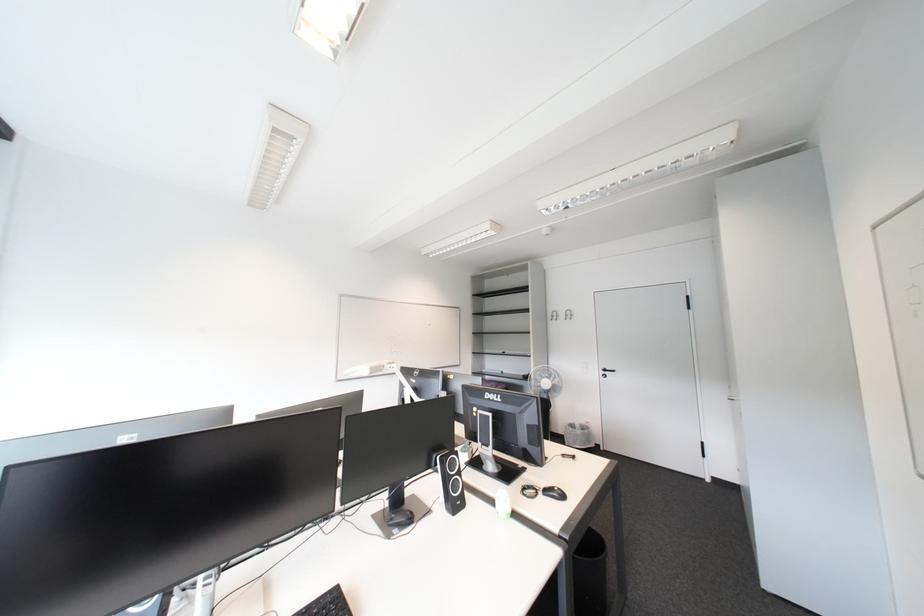
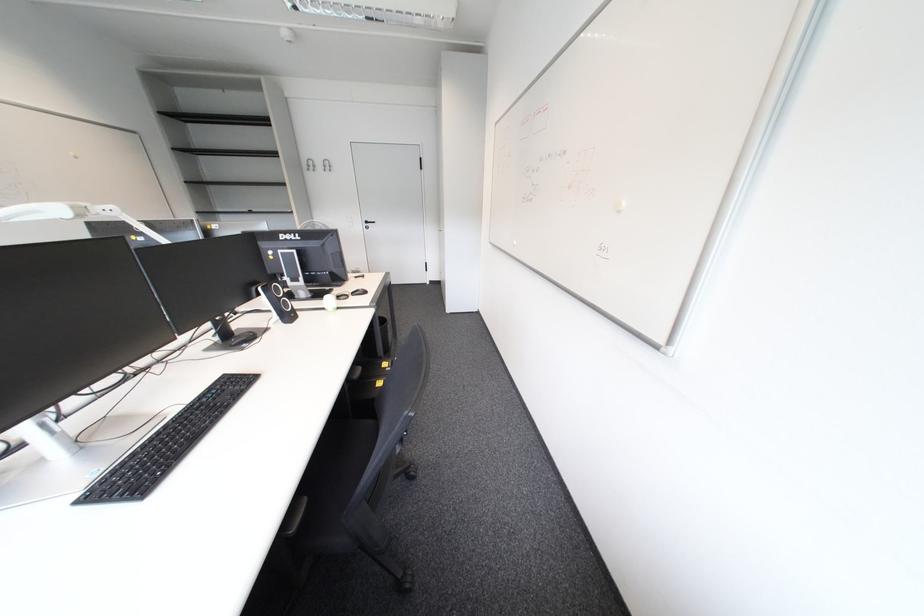
How did the camera likely rotate?

The rotation direction of the camera is right-down.